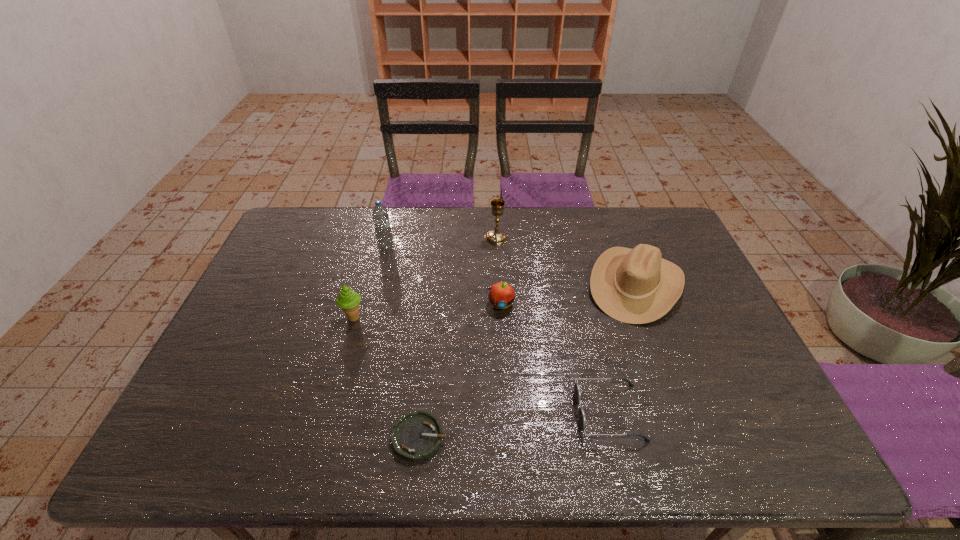
Locate an element on the screen. This screenshot has height=540, width=960. ashtray located in the near edge section of the desktop is located at coordinates (416, 436).

The height and width of the screenshot is (540, 960). I want to click on object located in the right edge section of the desktop, so click(x=637, y=286).

The image size is (960, 540). I want to click on vacant space at the far edge of the desktop, so click(476, 235).

This screenshot has width=960, height=540. What are the coordinates of `vacant space at the left edge of the desktop` in the screenshot? It's located at (284, 260).

What are the coordinates of `free space at the right edge of the desktop` in the screenshot? It's located at (718, 373).

Locate an element on the screen. The height and width of the screenshot is (540, 960). vacant point at the far left corner is located at coordinates (284, 233).

You are a GUI agent. You are given a task and a screenshot of the screen. Output one action in this format:
    pyautogui.click(x=<x>, y=<y>)
    Task: Click on the vacant point at the near right corner
    This screenshot has height=540, width=960.
    Given the screenshot: What is the action you would take?
    pyautogui.click(x=777, y=446)

Where is `free space that is in between the chalice and the ashtray`? This screenshot has width=960, height=540. free space that is in between the chalice and the ashtray is located at coordinates point(458,337).

The image size is (960, 540). In order to click on vacant point located between the tallest object and the chalice in this screenshot , I will do `click(442, 243)`.

Locate an element on the screen. unoccupied position between the apple and the chalice is located at coordinates (498, 271).